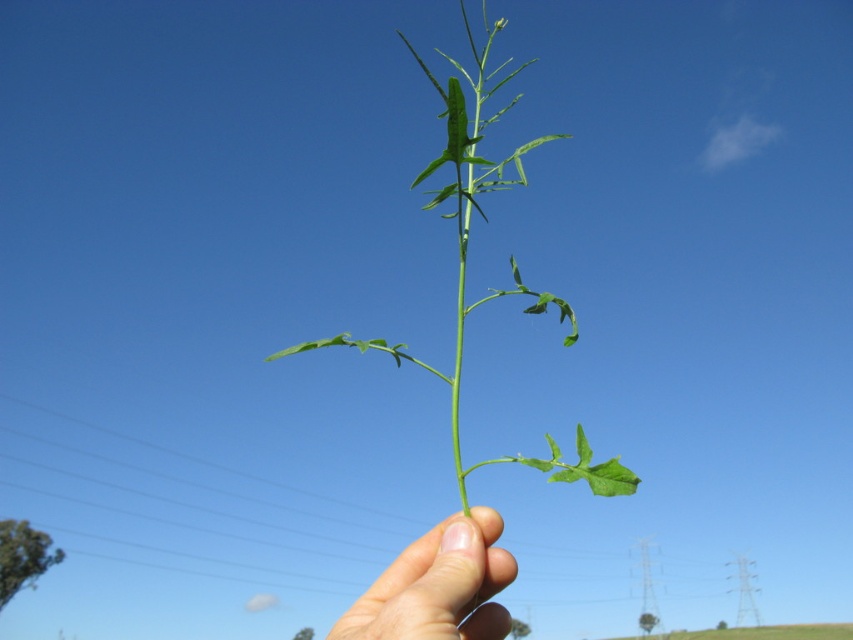
Between green leafy stem at center and skinny flesh at center, which one appears on the left side from the viewer's perspective?

skinny flesh at center is more to the left.

Does green leafy stem at center come behind skinny flesh at center?

No, it is not.

Does point (467, 180) come closer to viewer compared to point (422, 602)?

No, it is behind (422, 602).

The image size is (853, 640). I want to click on green leafy stem at center, so click(x=465, y=260).

Between skinny flesh at center and green matte leaf at center, which one is positioned higher?

Positioned higher is green matte leaf at center.

Based on the photo, does skinny flesh at center have a lesser width compared to green matte leaf at center?

In fact, skinny flesh at center might be wider than green matte leaf at center.

You are a GUI agent. You are given a task and a screenshot of the screen. Output one action in this format:
    pyautogui.click(x=<x>, y=<y>)
    Task: Click on the skinny flesh at center
    This screenshot has width=853, height=640.
    Given the screenshot: What is the action you would take?
    pyautogui.click(x=438, y=586)

Looking at this image, can you confirm if green leafy stem at center is positioned below green matte leaf at center?

Indeed, green leafy stem at center is positioned under green matte leaf at center.

Does green leafy stem at center have a larger size compared to green matte leaf at center?

Indeed, green leafy stem at center has a larger size compared to green matte leaf at center.

Who is more distant from viewer, (x=345, y=337) or (x=497, y=24)?

Point (x=497, y=24)

What are the coordinates of `green leafy stem at center` in the screenshot? It's located at (465, 260).